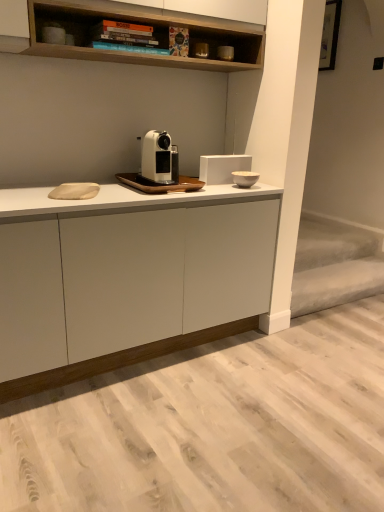
Question: Is white matte cabinet at center at the right side of white matte coffee machine at center?

Choices:
 (A) no
 (B) yes

Answer: (A)

Question: Considering the relative sizes of white matte cabinet at center and white matte coffee machine at center in the image provided, is white matte cabinet at center wider than white matte coffee machine at center?

Choices:
 (A) yes
 (B) no

Answer: (A)

Question: Considering the relative sizes of white matte cabinet at center and white matte coffee machine at center in the image provided, is white matte cabinet at center shorter than white matte coffee machine at center?

Choices:
 (A) yes
 (B) no

Answer: (B)

Question: Does white matte cabinet at center appear on the left side of white matte coffee machine at center?

Choices:
 (A) yes
 (B) no

Answer: (A)

Question: Is white matte coffee machine at center completely or partially inside white matte cabinet at center?

Choices:
 (A) no
 (B) yes

Answer: (A)

Question: Could you tell me if white matte cabinet at center is turned towards white matte coffee machine at center?

Choices:
 (A) yes
 (B) no

Answer: (B)

Question: Considering the relative positions of white matte cabinet at center and matte black coffee machine at upper center, which is the second appliance from bottom to top, in the image provided, is white matte cabinet at center to the left of matte black coffee machine at upper center, which is the second appliance from bottom to top, from the viewer's perspective?

Choices:
 (A) yes
 (B) no

Answer: (A)

Question: Is white matte cabinet at center not within matte black coffee machine at upper center, the first appliance viewed from the top?

Choices:
 (A) no
 (B) yes

Answer: (B)

Question: Considering the relative sizes of white matte cabinet at center and matte black coffee machine at upper center, the first appliance viewed from the top, in the image provided, is white matte cabinet at center smaller than matte black coffee machine at upper center, the first appliance viewed from the top,?

Choices:
 (A) no
 (B) yes

Answer: (A)

Question: Would you consider white matte cabinet at center to be distant from matte black coffee machine at upper center, the first appliance viewed from the top?

Choices:
 (A) no
 (B) yes

Answer: (B)

Question: Is white matte cabinet at center wider than matte black coffee machine at upper center, the first appliance viewed from the top?

Choices:
 (A) yes
 (B) no

Answer: (A)

Question: From a real-world perspective, is white matte cabinet at center below matte black coffee machine at upper center, the first appliance viewed from the top?

Choices:
 (A) no
 (B) yes

Answer: (B)

Question: Considering the relative sizes of white ceramic bowl at upper right, which is counted as the second appliance, starting from the top, and matte black coffee machine at upper center, which is the second appliance from bottom to top, in the image provided, is white ceramic bowl at upper right, which is counted as the second appliance, starting from the top, thinner than matte black coffee machine at upper center, which is the second appliance from bottom to top,?

Choices:
 (A) no
 (B) yes

Answer: (A)